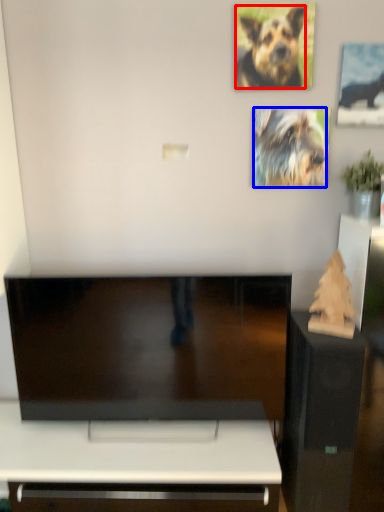
Question: Which object is closer to the camera taking this photo, dog (highlighted by a red box) or dog (highlighted by a blue box)?

Choices:
 (A) dog
 (B) dog

Answer: (A)